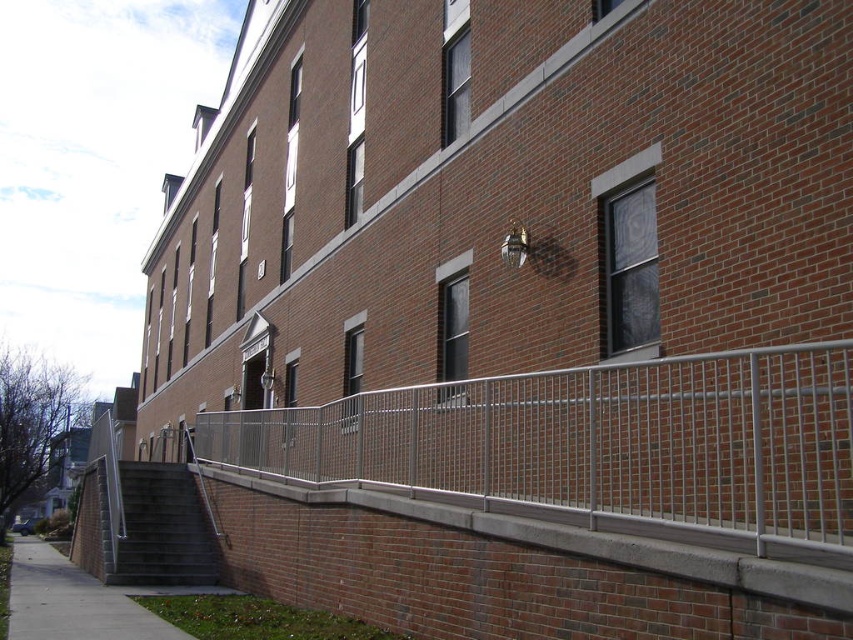
Between point (776, 493) and point (28, 628), which one is positioned in front?

Point (776, 493) is more forward.

Does silver metallic railing at lower center appear over gray concrete sidewalk at lower left?

Yes, silver metallic railing at lower center is above gray concrete sidewalk at lower left.

Is point (274, 417) behind point (18, 547)?

No, it is not.

Identify the location of silver metallic railing at lower center. This screenshot has width=853, height=640. (596, 445).

Is point (572, 410) behind point (194, 502)?

No, it is not.

Is point (303, 433) positioned before point (148, 540)?

Yes, point (303, 433) is in front of point (148, 540).

I want to click on silver metallic railing at lower center, so click(596, 445).

Who is more distant from viewer, (132,490) or (97,630)?

The point (132,490) is more distant.

Identify the location of gray concrete stairs at lower left. The height and width of the screenshot is (640, 853). (163, 529).

You are a GUI agent. You are given a task and a screenshot of the screen. Output one action in this format:
    pyautogui.click(x=<x>, y=<y>)
    Task: Click on the gray concrete stairs at lower left
    This screenshot has width=853, height=640.
    Given the screenshot: What is the action you would take?
    pyautogui.click(x=163, y=529)